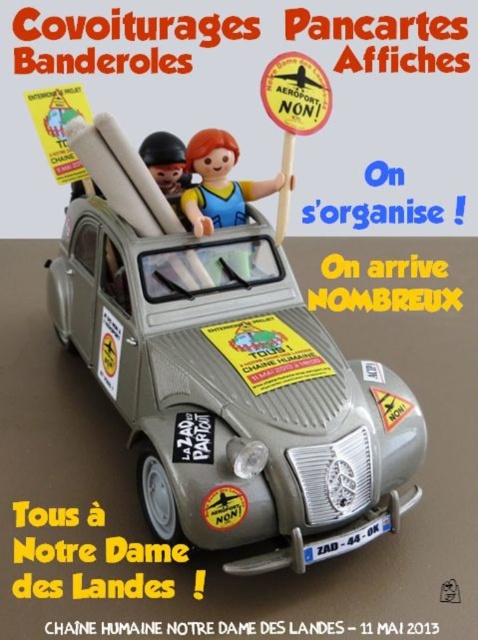
Based on the photo, you are a photographer trying to capture a closeup of the two points in the image. Which point, point (253, 332) or point (219, 134), is closer to your camera lens?

Point (253, 332) is closer to the camera lens than point (219, 134).

Looking at this image, you are designing a display stand for the promotional poster. The stand has a height limit of 1 meter. If the matte gray car at center and the orange paper sign at upper center are placed vertically on the stand, will both fit within the height limit?

The matte gray car at center has a greater height compared to orange paper sign at upper center. Since the car is taller than the sign, but the total height of both combined is not provided, it is uncertain if they will fit within the 1 meter limit. However, if placed individually, the car alone might exceed the limit depending on its height. More information is needed.